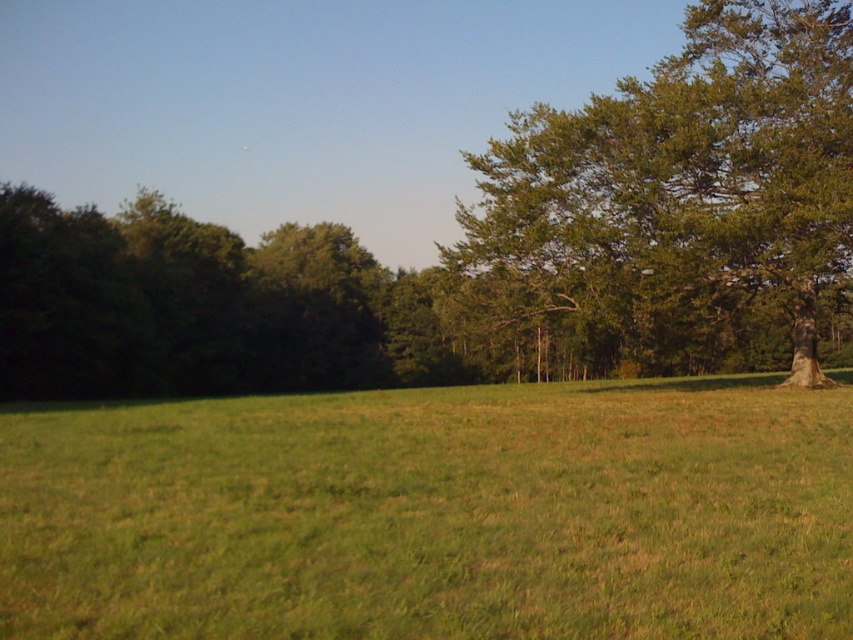
Question: Which of the following is the closest to the observer?

Choices:
 (A) green grass at center
 (B) green leafy tree at right

Answer: (A)

Question: Can you confirm if green grass at center is thinner than green leafy tree at right?

Choices:
 (A) no
 (B) yes

Answer: (B)

Question: Considering the relative positions of green grass at center and green leafy tree at right in the image provided, where is green grass at center located with respect to green leafy tree at right?

Choices:
 (A) right
 (B) left

Answer: (B)

Question: Is green grass at center to the left of green leafy tree at right from the viewer's perspective?

Choices:
 (A) yes
 (B) no

Answer: (A)